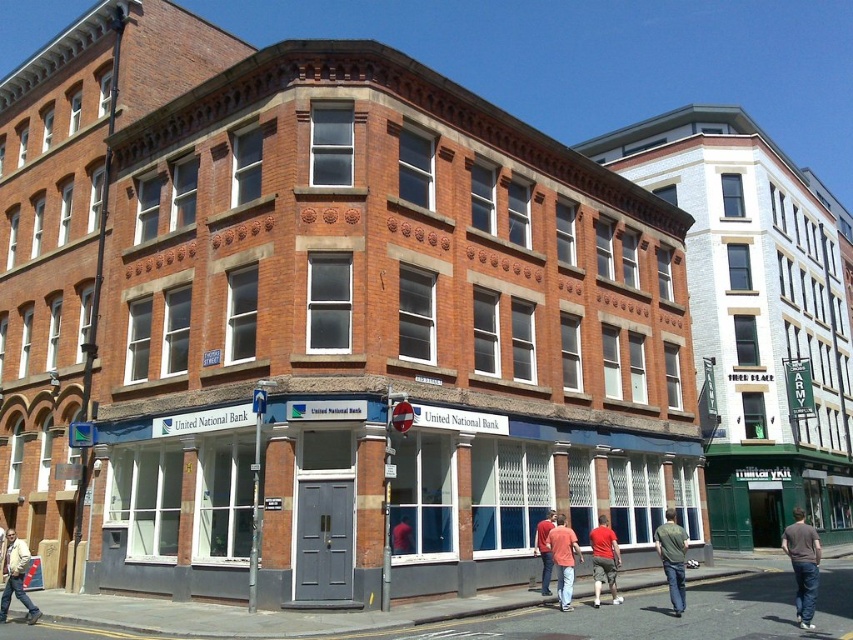
Does brick facade bank at center have a lesser width compared to denim jeans at lower right?

No, brick facade bank at center is not thinner than denim jeans at lower right.

Is point (613, 285) more distant than point (679, 598)?

Yes, point (613, 285) is behind point (679, 598).

Who is more distant from viewer, [572,212] or [669,593]?

Positioned behind is point [572,212].

Where is `brick facade bank at center`? The width and height of the screenshot is (853, 640). brick facade bank at center is located at coordinates (392, 412).

Is point (679, 589) more distant than point (563, 536)?

No, (679, 589) is closer to viewer.

Is denim jeans at lower right shorter than matte pink shirt at center?

No, denim jeans at lower right is not shorter than matte pink shirt at center.

Describe the element at coordinates (672, 557) in the screenshot. I see `denim jeans at lower right` at that location.

I want to click on denim jeans at lower right, so click(x=672, y=557).

Does point (798, 570) come farther from viewer compared to point (686, 536)?

No, (798, 570) is in front of (686, 536).

Which of these two, brown cotton shirt at lower right or denim jeans at lower right, stands shorter?

Standing shorter between the two is denim jeans at lower right.

Who is more distant from viewer, [804,605] or [685,540]?

The point [685,540] is more distant.

Find the location of a particular element. The image size is (853, 640). brown cotton shirt at lower right is located at coordinates (802, 564).